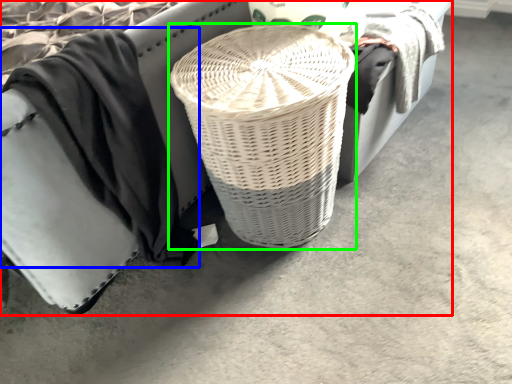
Question: Estimate the real-world distances between objects in this image. Which object is farther from furniture (highlighted by a red box), clothing (highlighted by a blue box) or basket (highlighted by a green box)?

Choices:
 (A) clothing
 (B) basket

Answer: (B)